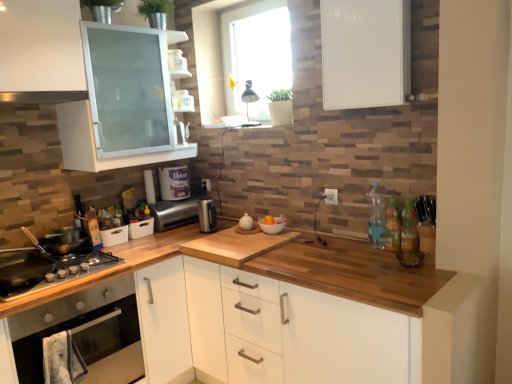
The width and height of the screenshot is (512, 384). I want to click on translucent plastic bottles at right, which is counted as the first bottle, starting from the right, so pyautogui.click(x=409, y=230).

Find the location of a particular element. Image resolution: width=512 pixels, height=384 pixels. satin silver exhaust hood at upper left is located at coordinates (42, 96).

What do you see at coordinates (174, 183) in the screenshot? I see `white plastic container at center, which appears as the 1th appliance when viewed from the top` at bounding box center [174, 183].

You are a GUI agent. You are given a task and a screenshot of the screen. Output one action in this format:
    pyautogui.click(x=<x>, y=<y>)
    Task: Click on the satin silver toaster at center, which is the second appliance in top-to-bottom order
    This screenshot has height=384, width=512.
    Given the screenshot: What is the action you would take?
    pyautogui.click(x=175, y=213)

In order to face satin silver toaster at center, which is the second appliance in top-to-bottom order, should I rotate leftwards or rightwards?

Turn left approximately 10.207 degrees to face it.

The height and width of the screenshot is (384, 512). I want to click on clear plastic bottle at right, which ranks as the second bottle in right-to-left order, so click(393, 226).

Locate an element on the screen. This screenshot has height=384, width=512. translucent plastic bottles at right, which is counted as the first bottle, starting from the right is located at coordinates [x=409, y=230].

Is translucent plastic bottles at right, arranged as the 3th bottle when viewed from the left, not close to white matte cabinet at upper right, the first cabinetry viewed from the top?

No, translucent plastic bottles at right, arranged as the 3th bottle when viewed from the left, is not far from white matte cabinet at upper right, the first cabinetry viewed from the top.

Is translucent plastic bottles at right, which is counted as the first bottle, starting from the right, wider than white matte cabinet at upper right, the first cabinetry viewed from the top?

In fact, translucent plastic bottles at right, which is counted as the first bottle, starting from the right, might be narrower than white matte cabinet at upper right, the first cabinetry viewed from the top.

Is white matte cabinet at upper right, acting as the second cabinetry starting from the bottom, at the back of translucent plastic bottles at right, which is counted as the first bottle, starting from the right?

translucent plastic bottles at right, which is counted as the first bottle, starting from the right, is not turned away from white matte cabinet at upper right, acting as the second cabinetry starting from the bottom.

At what (x,y) coordinates should I click in order to perform the action: click on the 3rd bottle counting from the right of the white matte cabinet at upper right, acting as the second cabinetry starting from the bottom. Please return your answer as a coordinate pair (x, y). Looking at the image, I should click on (409, 230).

Is white plastic container at center, which appears as the 1th appliance when viewed from the top, positioned far away from wooden countertop at center, which ranks as the first cabinetry in bottom-to-top order?

That's right, there is a large distance between white plastic container at center, which appears as the 1th appliance when viewed from the top, and wooden countertop at center, which ranks as the first cabinetry in bottom-to-top order.

From the image's perspective, which one is positioned higher, white plastic container at center, which appears as the 1th appliance when viewed from the top, or wooden countertop at center, which ranks as the first cabinetry in bottom-to-top order?

white plastic container at center, which appears as the 1th appliance when viewed from the top.

In terms of width, does white plastic container at center, which is the 2th appliance in bottom-to-top order, look wider or thinner when compared to wooden countertop at center, the second cabinetry from the top?

Considering their sizes, white plastic container at center, which is the 2th appliance in bottom-to-top order, looks slimmer than wooden countertop at center, the second cabinetry from the top.

Between clear plastic bottle at right, which ranks as the second bottle in right-to-left order, and translucent plastic bottles at right, which is counted as the first bottle, starting from the right, which one has larger width?

Wider between the two is translucent plastic bottles at right, which is counted as the first bottle, starting from the right.

From the picture: Between clear plastic bottle at right, placed as the 2th bottle when sorted from left to right, and translucent plastic bottles at right, which is counted as the first bottle, starting from the right, which one has less height?

clear plastic bottle at right, placed as the 2th bottle when sorted from left to right, is shorter.

Does point (396, 245) appear closer or farther from the camera than point (410, 215)?

Point (396, 245) appears to be farther away from the viewer than point (410, 215).

Consider the image. From a real-world perspective, is clear plastic bottle at right, which ranks as the second bottle in right-to-left order, positioned under translucent plastic bottles at right, which is counted as the first bottle, starting from the right, based on gravity?

Yes, from a real-world perspective, clear plastic bottle at right, which ranks as the second bottle in right-to-left order, is below translucent plastic bottles at right, which is counted as the first bottle, starting from the right.

Can you confirm if white plastic container at center, which appears as the 1th appliance when viewed from the top, is thinner than satin silver toaster at center, which is the second appliance in top-to-bottom order?

Indeed, white plastic container at center, which appears as the 1th appliance when viewed from the top, has a lesser width compared to satin silver toaster at center, which is the second appliance in top-to-bottom order.

Consider the image. Is white plastic container at center, which appears as the 1th appliance when viewed from the top, at the left side of satin silver toaster at center, placed as the first appliance when sorted from bottom to top?

Indeed, white plastic container at center, which appears as the 1th appliance when viewed from the top, is positioned on the left side of satin silver toaster at center, placed as the first appliance when sorted from bottom to top.

Who is bigger, white plastic container at center, which appears as the 1th appliance when viewed from the top, or satin silver toaster at center, which is the second appliance in top-to-bottom order?

Bigger between the two is satin silver toaster at center, which is the second appliance in top-to-bottom order.

Is white plastic container at center, which is the 2th appliance in bottom-to-top order, oriented away from satin silver toaster at center, which is the second appliance in top-to-bottom order?

No, white plastic container at center, which is the 2th appliance in bottom-to-top order,'s orientation is not away from satin silver toaster at center, which is the second appliance in top-to-bottom order.

Which object is more forward, clear plastic bottle at right, which is counted as the 3th bottle, starting from the right, or white matte cabinet at upper right, acting as the second cabinetry starting from the bottom?

white matte cabinet at upper right, acting as the second cabinetry starting from the bottom.

Can you tell me how much clear plastic bottle at right, placed as the first bottle when sorted from left to right, and white matte cabinet at upper right, acting as the second cabinetry starting from the bottom, differ in facing direction?

3.36 degrees.

Does clear plastic bottle at right, placed as the first bottle when sorted from left to right, appear on the left side of white matte cabinet at upper right, acting as the second cabinetry starting from the bottom?

No, clear plastic bottle at right, placed as the first bottle when sorted from left to right, is not to the left of white matte cabinet at upper right, acting as the second cabinetry starting from the bottom.

Does clear plastic bottle at right, which is counted as the 3th bottle, starting from the right, have a lesser width compared to white matte cabinet at upper right, acting as the second cabinetry starting from the bottom?

Correct, the width of clear plastic bottle at right, which is counted as the 3th bottle, starting from the right, is less than that of white matte cabinet at upper right, acting as the second cabinetry starting from the bottom.

Based on the photo, how distant is satin silver toaster at center, which is the second appliance in top-to-bottom order, from satin silver exhaust hood at upper left?

satin silver toaster at center, which is the second appliance in top-to-bottom order, and satin silver exhaust hood at upper left are 38.37 inches apart from each other.

Does satin silver toaster at center, which is the second appliance in top-to-bottom order, have a greater width compared to satin silver exhaust hood at upper left?

In fact, satin silver toaster at center, which is the second appliance in top-to-bottom order, might be narrower than satin silver exhaust hood at upper left.

Is satin silver toaster at center, which is the second appliance in top-to-bottom order, completely or partially outside of satin silver exhaust hood at upper left?

satin silver toaster at center, which is the second appliance in top-to-bottom order, is positioned outside satin silver exhaust hood at upper left.

From the image's perspective, is satin silver toaster at center, placed as the first appliance when sorted from bottom to top, located beneath satin silver exhaust hood at upper left?

Yes.

Is clear plastic bottle at right, placed as the first bottle when sorted from left to right, at the right side of white plastic container at center, which appears as the 1th appliance when viewed from the top?

Indeed, clear plastic bottle at right, placed as the first bottle when sorted from left to right, is positioned on the right side of white plastic container at center, which appears as the 1th appliance when viewed from the top.

Is clear plastic bottle at right, placed as the first bottle when sorted from left to right, next to white plastic container at center, which appears as the 1th appliance when viewed from the top, and touching it?

No, clear plastic bottle at right, placed as the first bottle when sorted from left to right, is not making contact with white plastic container at center, which appears as the 1th appliance when viewed from the top.

From a real-world perspective, is clear plastic bottle at right, which is counted as the 3th bottle, starting from the right, physically above white plastic container at center, which is the 2th appliance in bottom-to-top order?

No, from a real-world perspective, clear plastic bottle at right, which is counted as the 3th bottle, starting from the right, is not on top of white plastic container at center, which is the 2th appliance in bottom-to-top order.

Is clear plastic bottle at right, which is counted as the 3th bottle, starting from the right, situated inside white plastic container at center, which is the 2th appliance in bottom-to-top order, or outside?

clear plastic bottle at right, which is counted as the 3th bottle, starting from the right, is not enclosed by white plastic container at center, which is the 2th appliance in bottom-to-top order.

The width and height of the screenshot is (512, 384). I want to click on cabinetry above the translucent plastic bottles at right, arranged as the 3th bottle when viewed from the left (from the image's perspective), so click(x=365, y=53).

Locate an element on the screen. cabinetry below the white plastic container at center, which is the 2th appliance in bottom-to-top order (from a real-world perspective) is located at coordinates (292, 331).

Considering their positions, is transparent glass window at upper center positioned closer to wooden at left than white matte cabinet at upper right, acting as the second cabinetry starting from the bottom?

white matte cabinet at upper right, acting as the second cabinetry starting from the bottom.

Looking at the image, which one is located further to clear plastic bottle at right, placed as the first bottle when sorted from left to right, wooden countertop at center, the second cabinetry from the top, or transparent glass window at upper center?

The object further to clear plastic bottle at right, placed as the first bottle when sorted from left to right, is transparent glass window at upper center.

Based on their spatial positions, is satin silver exhaust hood at upper left or transparent glass window at upper center closer to satin silver toaster at center, which is the second appliance in top-to-bottom order?

Based on the image, transparent glass window at upper center appears to be nearer to satin silver toaster at center, which is the second appliance in top-to-bottom order.

From the image, which object appears to be farther from satin silver exhaust hood at upper left, stainless steel gas stove at lower left or white plastic container at center, which is the 2th appliance in bottom-to-top order?

white plastic container at center, which is the 2th appliance in bottom-to-top order, lies further to satin silver exhaust hood at upper left than the other object.

Estimate the real-world distances between objects in this image. Which object is closer to wooden at left, clear plastic bottle at right, placed as the first bottle when sorted from left to right, or transparent glass window at upper center?

clear plastic bottle at right, placed as the first bottle when sorted from left to right, lies closer to wooden at left than the other object.

Considering their positions, is stainless steel gas stove at lower left positioned closer to satin silver toaster at center, placed as the first appliance when sorted from bottom to top, than wooden at left?

stainless steel gas stove at lower left lies closer to satin silver toaster at center, placed as the first appliance when sorted from bottom to top, than the other object.

Estimate the real-world distances between objects in this image. Which object is closer to satin silver toaster at center, placed as the first appliance when sorted from bottom to top, wooden countertop at center, which ranks as the first cabinetry in bottom-to-top order, or stainless steel gas stove at lower left?

The object closer to satin silver toaster at center, placed as the first appliance when sorted from bottom to top, is stainless steel gas stove at lower left.

Considering their positions, is white plastic container at center, which is the 2th appliance in bottom-to-top order, positioned closer to wooden at left than translucent plastic bottles at right, which is counted as the first bottle, starting from the right?

The object closer to wooden at left is translucent plastic bottles at right, which is counted as the first bottle, starting from the right.

The height and width of the screenshot is (384, 512). What are the coordinates of `window between white matte cabinet at upper right, acting as the second cabinetry starting from the bottom, and white plastic container at center, which appears as the 1th appliance when viewed from the top, from front to back` in the screenshot? It's located at (210, 57).

Where is `window located between white plastic container at center, which is the 2th appliance in bottom-to-top order, and translucent plastic bottles at right, arranged as the 3th bottle when viewed from the left, in the left-right direction`? This screenshot has height=384, width=512. window located between white plastic container at center, which is the 2th appliance in bottom-to-top order, and translucent plastic bottles at right, arranged as the 3th bottle when viewed from the left, in the left-right direction is located at coordinates (210, 57).

Locate an element on the screen. The height and width of the screenshot is (384, 512). countertop situated between stainless steel oven at lower left and translucent plastic bottles at right, which is counted as the first bottle, starting from the right, from left to right is located at coordinates (359, 277).

The height and width of the screenshot is (384, 512). Find the location of `oven between satin silver exhaust hood at upper left and clear plastic bottle at right, which ranks as the second bottle in right-to-left order`. oven between satin silver exhaust hood at upper left and clear plastic bottle at right, which ranks as the second bottle in right-to-left order is located at coordinates [84, 332].